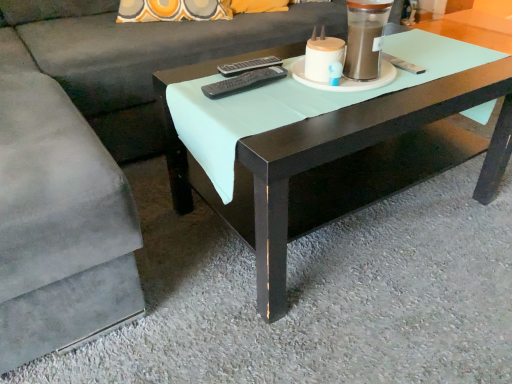
The image size is (512, 384). In order to click on free space in front of black plastic remote at center, the 2th remote viewed from the back in this screenshot , I will do `click(258, 110)`.